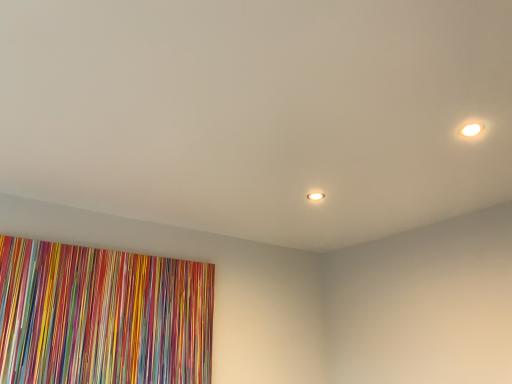
This screenshot has height=384, width=512. Find the location of `matte white light fixture at center`. matte white light fixture at center is located at coordinates (315, 196).

Image resolution: width=512 pixels, height=384 pixels. What do you see at coordinates (315, 196) in the screenshot? I see `matte white light fixture at center` at bounding box center [315, 196].

In order to face matte white light fixture at center, should I rotate leftwards or rightwards?

Rotate right and turn 8.133 degrees.

The width and height of the screenshot is (512, 384). I want to click on matte white light fixture at center, so click(315, 196).